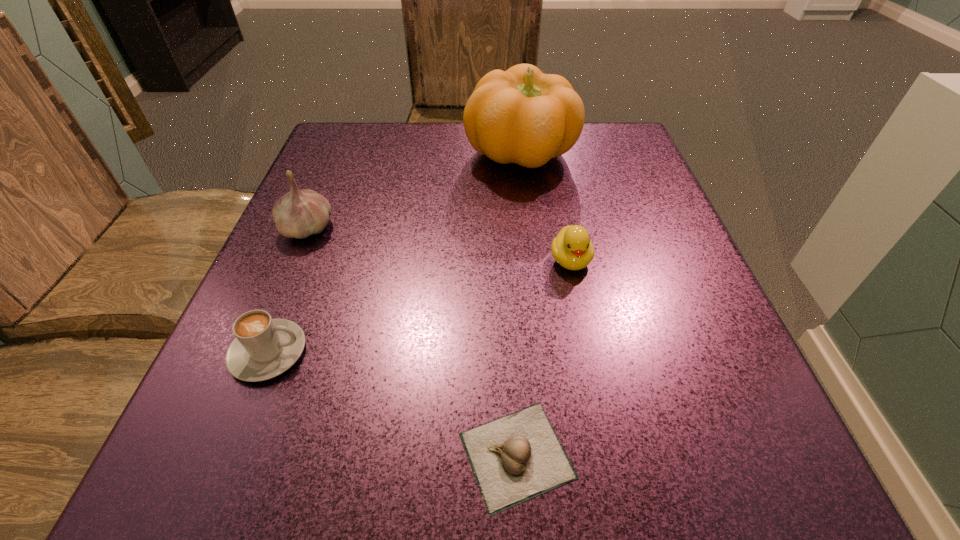
Where is `free location that satisfies the following two spatial constraints: 1. on the front side of the shorter garlic; 2. on the right side of the taller garlic`? This screenshot has height=540, width=960. free location that satisfies the following two spatial constraints: 1. on the front side of the shorter garlic; 2. on the right side of the taller garlic is located at coordinates (211, 455).

Find the location of a particular element. The height and width of the screenshot is (540, 960). free location that satisfies the following two spatial constraints: 1. on the back side of the fourth shortest object; 2. on the right side of the pumpkin is located at coordinates (338, 155).

You are a GUI agent. You are given a task and a screenshot of the screen. Output one action in this format:
    pyautogui.click(x=<x>, y=<y>)
    Task: Click on the vacant region that satisfies the following two spatial constraints: 1. on the beak of the third shortest object; 2. to the right of the fourth farthest object
    The image size is (960, 540).
    Given the screenshot: What is the action you would take?
    point(589,352)

This screenshot has height=540, width=960. Find the location of `vacant position in the image that satisfies the following two spatial constraints: 1. on the beak of the duckling; 2. to the right of the second shortest object`. vacant position in the image that satisfies the following two spatial constraints: 1. on the beak of the duckling; 2. to the right of the second shortest object is located at coordinates (589, 352).